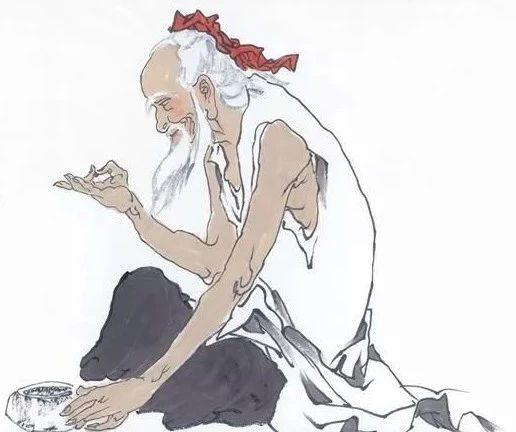
At what (x,y) coordinates should I click in order to perform the action: click on bowl. Please return your answer as a coordinate pair (x, y). Looking at the image, I should click on (24, 412).